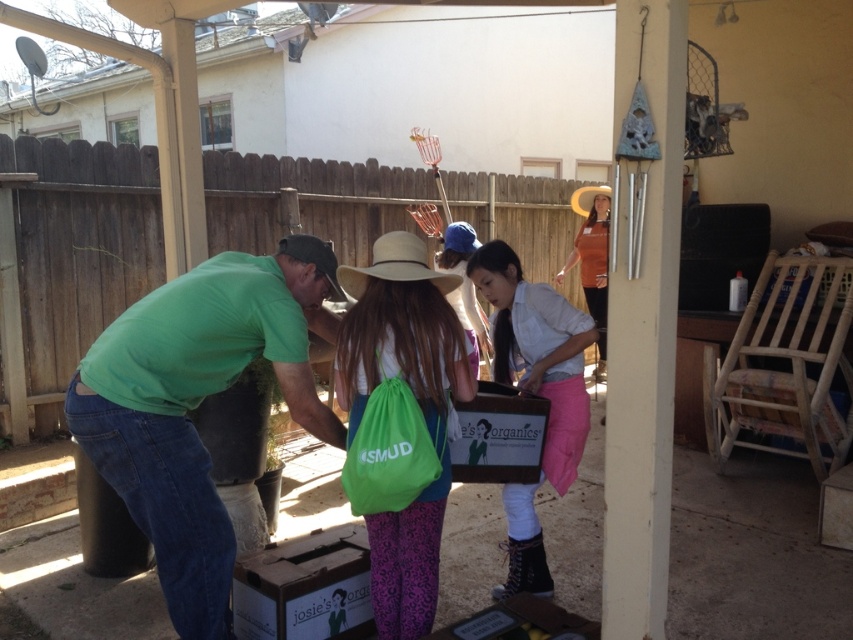
You are a photographer standing at the edge of the patio and want to take a photo of the white matte shirt at center and the beige straw hat at center. Which object should you focus on first to ensure both are in clear view?

The white matte shirt at center is further to the viewer than the beige straw hat at center, so you should focus on the white matte shirt at center first to ensure both are in clear view.

You are standing at point (347,269) and want to move to the wooden fence in the background. Is the point (512,488) in your path?

Yes, because point (512,488) is behind point (347,269), so it would be along the path towards the wooden fence.

You are organizing a picnic and have a green fabric bag at center and a beige straw hat at center. Which item is located below the other?

The green fabric bag at center is positioned under beige straw hat at center.